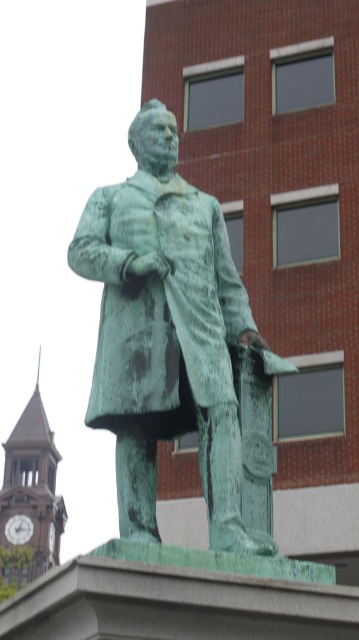
You are standing in front of the statue and want to locate two specific points marked on the image. The first point is at coordinates point (230, 312) and the second is at point (10, 461). Which of these points is nearer to you?

The point at coordinates point (230, 312) is closer to the viewer than point (10, 461).

You are an architect designing a new park layout. You need to place a bench between the green patina statue at center and the brown wooden clock tower at left. Based on their sizes, which object should the bench be closer to?

The bench should be closer to the brown wooden clock tower at left because the green patina statue at center occupies less space, meaning the clock tower is larger and requires more distance between them.